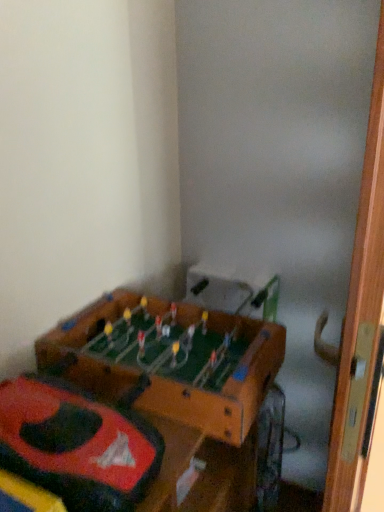
Question: Should I look upward or downward to see rubberized red car at lower left?

Choices:
 (A) up
 (B) down

Answer: (B)

Question: Considering the relative sizes of wooden door at right and wooden foosball table at lower left in the image provided, is wooden door at right smaller than wooden foosball table at lower left?

Choices:
 (A) yes
 (B) no

Answer: (B)

Question: From the image's perspective, is wooden door at right over wooden foosball table at lower left?

Choices:
 (A) yes
 (B) no

Answer: (B)

Question: Can you confirm if wooden door at right is shorter than wooden foosball table at lower left?

Choices:
 (A) no
 (B) yes

Answer: (A)

Question: Is the depth of wooden door at right greater than that of wooden foosball table at lower left?

Choices:
 (A) yes
 (B) no

Answer: (B)

Question: Can you confirm if wooden door at right is wider than wooden foosball table at lower left?

Choices:
 (A) no
 (B) yes

Answer: (A)

Question: From a real-world perspective, does wooden door at right sit lower than wooden foosball table at lower left?

Choices:
 (A) yes
 (B) no

Answer: (A)

Question: Is rubberized red car at lower left turned away from wooden door at right?

Choices:
 (A) no
 (B) yes

Answer: (A)

Question: From the image's perspective, does rubberized red car at lower left appear higher than wooden door at right?

Choices:
 (A) no
 (B) yes

Answer: (B)

Question: Is rubberized red car at lower left at the right side of wooden door at right?

Choices:
 (A) yes
 (B) no

Answer: (B)

Question: Can wooden door at right be found inside rubberized red car at lower left?

Choices:
 (A) yes
 (B) no

Answer: (B)

Question: Does rubberized red car at lower left have a greater width compared to wooden door at right?

Choices:
 (A) yes
 (B) no

Answer: (A)

Question: Considering the relative positions of rubberized red car at lower left and wooden door at right in the image provided, is rubberized red car at lower left to the left of wooden door at right from the viewer's perspective?

Choices:
 (A) yes
 (B) no

Answer: (A)

Question: Is wooden foosball table at lower left next to wooden door at right?

Choices:
 (A) no
 (B) yes

Answer: (A)